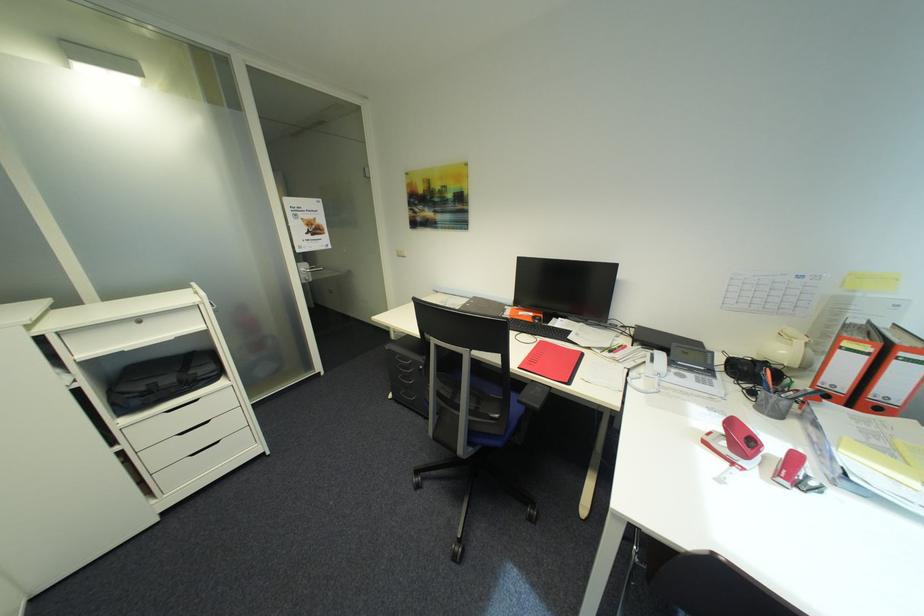
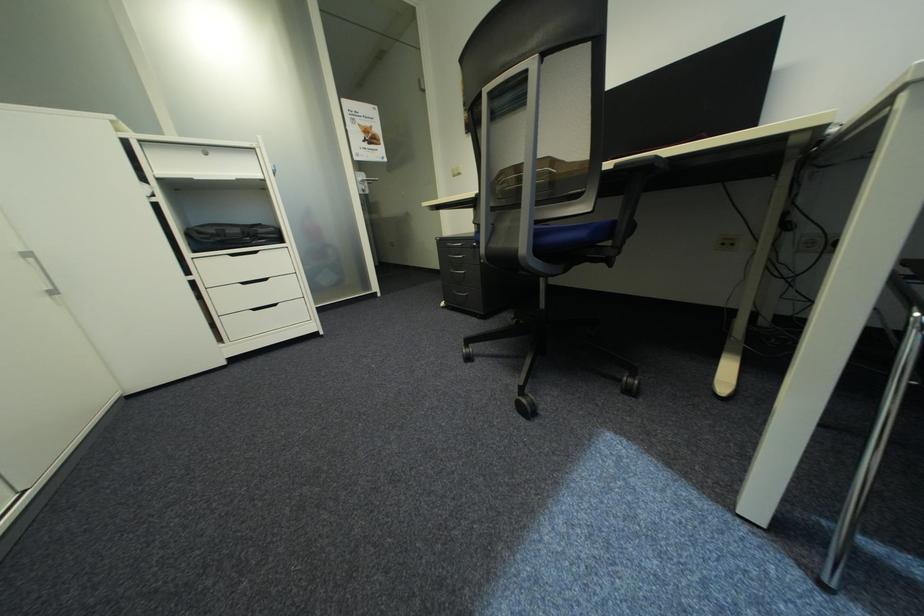
The point at (126, 448) is marked in the first image. Where is the corresponding point in the second image?

(199, 278)